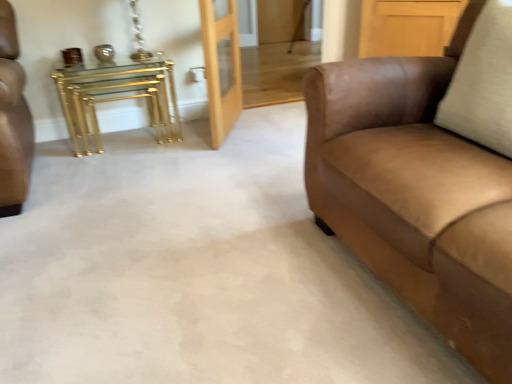
Question: Considering the relative positions of gold metallic nesting tables at left and suede brown couch at right in the image provided, is gold metallic nesting tables at left behind suede brown couch at right?

Choices:
 (A) yes
 (B) no

Answer: (A)

Question: Does gold metallic nesting tables at left appear on the left side of suede brown couch at right?

Choices:
 (A) no
 (B) yes

Answer: (B)

Question: Considering the relative sizes of gold metallic nesting tables at left and suede brown couch at right in the image provided, is gold metallic nesting tables at left bigger than suede brown couch at right?

Choices:
 (A) yes
 (B) no

Answer: (B)

Question: Does gold metallic nesting tables at left have a greater width compared to suede brown couch at right?

Choices:
 (A) yes
 (B) no

Answer: (B)

Question: Can you confirm if gold metallic nesting tables at left is shorter than suede brown couch at right?

Choices:
 (A) no
 (B) yes

Answer: (B)

Question: From the image's perspective, is gold metallic nesting tables at left above suede brown couch at right?

Choices:
 (A) no
 (B) yes

Answer: (B)

Question: Is gold metallic nesting tables at left thinner than light wood/glass door at center?

Choices:
 (A) yes
 (B) no

Answer: (B)

Question: Considering the relative sizes of gold metallic nesting tables at left and light wood/glass door at center in the image provided, is gold metallic nesting tables at left smaller than light wood/glass door at center?

Choices:
 (A) yes
 (B) no

Answer: (B)

Question: Considering the relative sizes of gold metallic nesting tables at left and light wood/glass door at center in the image provided, is gold metallic nesting tables at left bigger than light wood/glass door at center?

Choices:
 (A) yes
 (B) no

Answer: (A)

Question: Is gold metallic nesting tables at left to the left of light wood/glass door at center from the viewer's perspective?

Choices:
 (A) yes
 (B) no

Answer: (A)

Question: From a real-world perspective, is gold metallic nesting tables at left over light wood/glass door at center?

Choices:
 (A) no
 (B) yes

Answer: (A)

Question: From a real-world perspective, is gold metallic nesting tables at left below light wood/glass door at center?

Choices:
 (A) no
 (B) yes

Answer: (B)

Question: Is suede brown couch at right bigger than light wood/glass door at center?

Choices:
 (A) yes
 (B) no

Answer: (A)